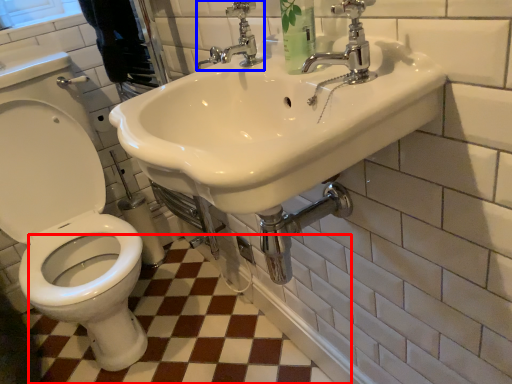
Question: Which object is further to the camera taking this photo, ceramic tile (highlighted by a red box) or tap (highlighted by a blue box)?

Choices:
 (A) ceramic tile
 (B) tap

Answer: (A)